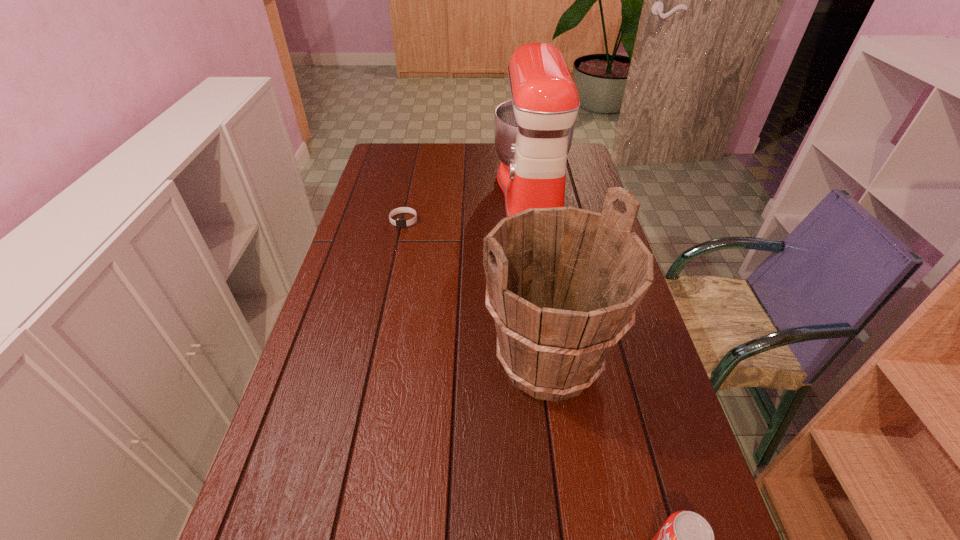
This screenshot has width=960, height=540. What are the coordinates of `free space that satisfies the following two spatial constraints: 1. on the outer surface of the shortest object; 2. on the left side of the bucket` in the screenshot? It's located at (373, 362).

The width and height of the screenshot is (960, 540). What are the coordinates of `blank space that satisfies the following two spatial constraints: 1. on the front-facing side of the mixer; 2. on the outer surface of the wristband` in the screenshot? It's located at (536, 221).

This screenshot has width=960, height=540. Identify the location of free space that satisfies the following two spatial constraints: 1. on the front-facing side of the mixer; 2. on the outer surface of the shortest object. (536, 221).

Locate an element on the screen. The width and height of the screenshot is (960, 540). free space in the image that satisfies the following two spatial constraints: 1. on the front-facing side of the mixer; 2. on the front side of the third farthest object is located at coordinates (558, 362).

This screenshot has width=960, height=540. Identify the location of free location that satisfies the following two spatial constraints: 1. on the front-facing side of the mixer; 2. on the outer surface of the shortest object. (536, 221).